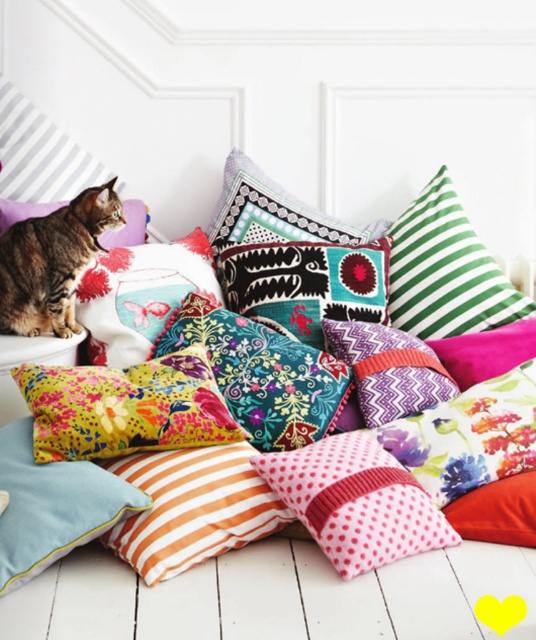
Question: Is green striped pillow at upper right smaller than tabby fur cat at upper left?

Choices:
 (A) no
 (B) yes

Answer: (A)

Question: In this image, where is orange striped pillow at center located relative to green striped pillow at upper right?

Choices:
 (A) left
 (B) right

Answer: (A)

Question: Which point is closer to the camera taking this photo?

Choices:
 (A) (277, 228)
 (B) (435, 529)
 (C) (512, 317)

Answer: (B)

Question: Estimate the real-world distances between objects in this image. Which object is closer to the orange striped pillow at center?

Choices:
 (A) green striped pillow at upper right
 (B) floral velvet cushion at center
 (C) tabby fur cat at upper left

Answer: (B)

Question: Where is floral velvet cushion at center located in relation to textured multicolored cushion at center in the image?

Choices:
 (A) left
 (B) right

Answer: (A)

Question: Which object is closer to the camera taking this photo?

Choices:
 (A) pink dotted fabric pillow at center
 (B) green striped pillow at upper right
 (C) textured multicolored cushion at center
 (D) floral velvet cushion at center

Answer: (A)